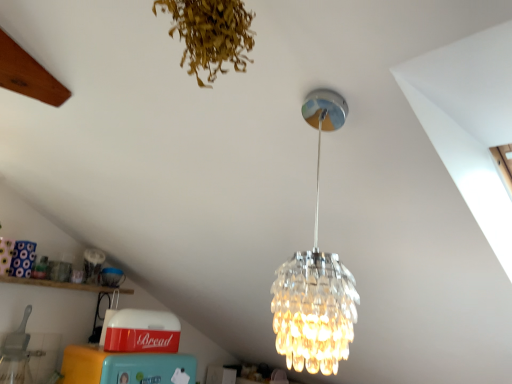
Question: Considering the relative positions of clear glass chandelier at center and brown dried leaves at upper center in the image provided, is clear glass chandelier at center to the right of brown dried leaves at upper center from the viewer's perspective?

Choices:
 (A) yes
 (B) no

Answer: (A)

Question: From the image's perspective, is clear glass chandelier at center over brown dried leaves at upper center?

Choices:
 (A) yes
 (B) no

Answer: (B)

Question: From a real-world perspective, is clear glass chandelier at center beneath brown dried leaves at upper center?

Choices:
 (A) yes
 (B) no

Answer: (A)

Question: Is brown dried leaves at upper center inside clear glass chandelier at center?

Choices:
 (A) yes
 (B) no

Answer: (B)

Question: Could you tell me if clear glass chandelier at center is turned towards brown dried leaves at upper center?

Choices:
 (A) yes
 (B) no

Answer: (A)

Question: Is clear glass chandelier at center turned away from brown dried leaves at upper center?

Choices:
 (A) yes
 (B) no

Answer: (B)

Question: From a real-world perspective, is clear glass chandelier at center located higher than wooden shelf at lower left?

Choices:
 (A) no
 (B) yes

Answer: (B)

Question: Is clear glass chandelier at center outside of wooden shelf at lower left?

Choices:
 (A) yes
 (B) no

Answer: (A)

Question: Would you consider clear glass chandelier at center to be distant from wooden shelf at lower left?

Choices:
 (A) yes
 (B) no

Answer: (A)

Question: Does clear glass chandelier at center turn towards wooden shelf at lower left?

Choices:
 (A) yes
 (B) no

Answer: (B)

Question: Is clear glass chandelier at center looking in the opposite direction of wooden shelf at lower left?

Choices:
 (A) no
 (B) yes

Answer: (A)

Question: Is clear glass chandelier at center to the left of wooden shelf at lower left from the viewer's perspective?

Choices:
 (A) yes
 (B) no

Answer: (B)

Question: Would you say brown dried leaves at upper center is part of wooden shelf at lower left's contents?

Choices:
 (A) no
 (B) yes

Answer: (A)